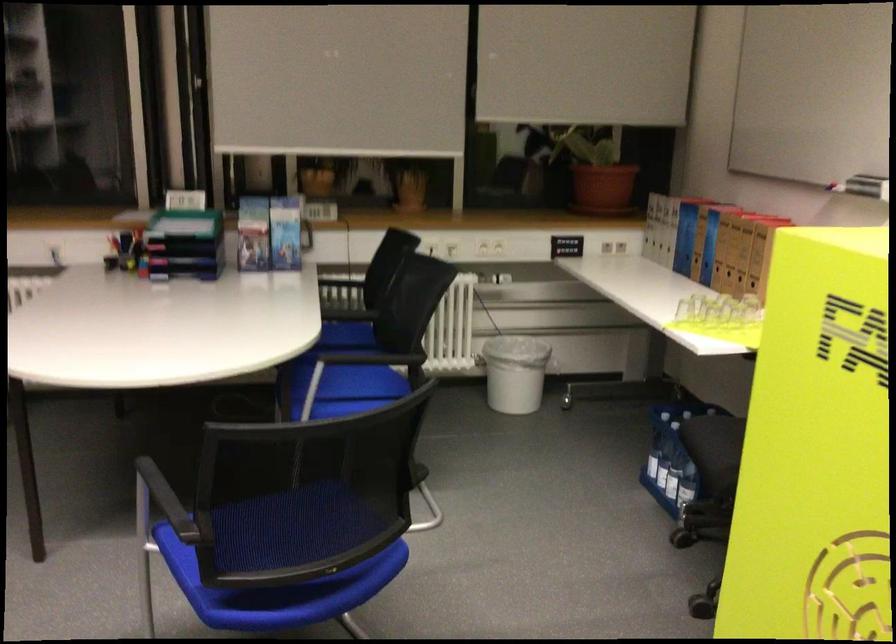
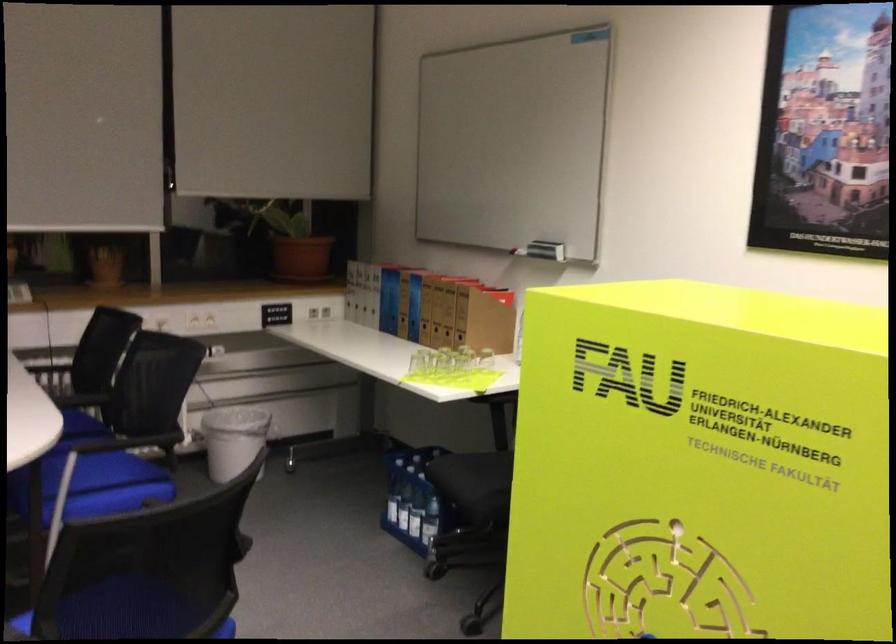
The point at (592, 169) is marked in the first image. Where is the corresponding point in the second image?

(294, 243)